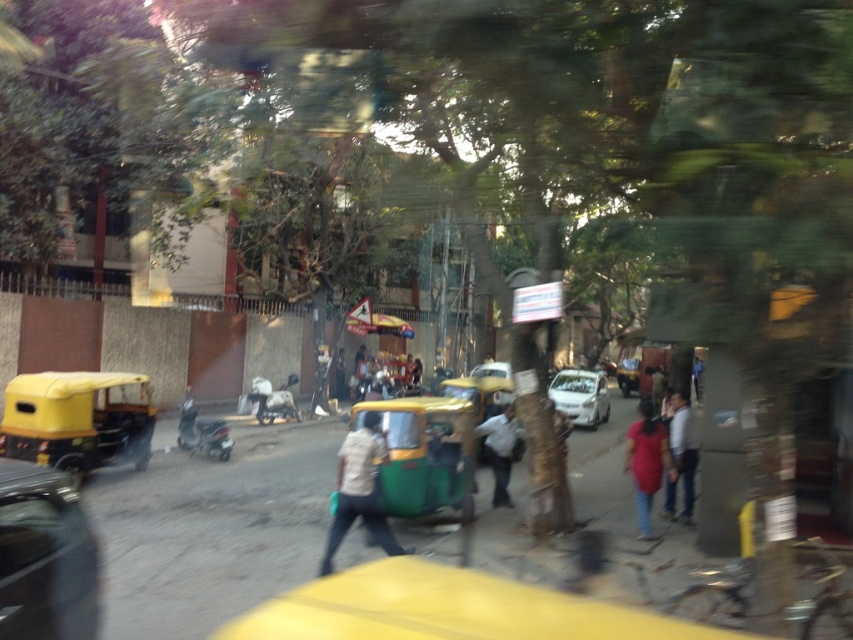
You are a photographer standing on the sidewalk. You want to take a photo of the light brown fabric shirt at center and the light blue jeans at center so that both are in focus. Based on the scene description, what is the minimum distance you need to be from the subjects to ensure both are in focus?

The light brown fabric shirt at center and light blue jeans at center are 4.12 meters apart. To ensure both are in focus, you should position yourself at least 4.12 meters away from the closest subject.

Looking at this image, you are a passenger in a vehicle and notice a metallic silver car at lower left in the scene. Based on its position coordinates, can you determine if it is closer to the front or the back of your vehicle?

The metallic silver car at lower left is located at point 0.870 on the x axis and 0.054 on the y axis. Since the x coordinate is closer to 1, it is positioned more to the right side of the scene, but given the y coordinate is very low, it is closer to the front of the vehicle.